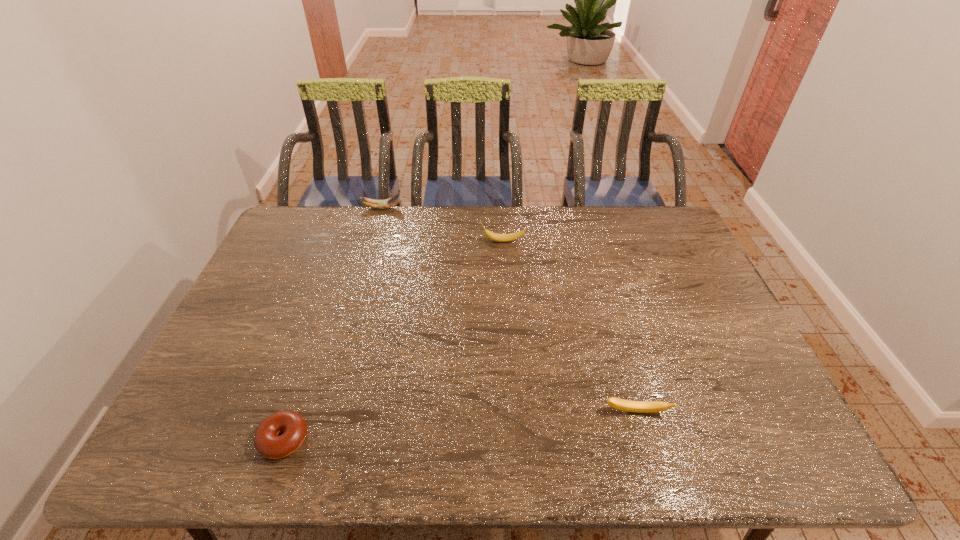
This screenshot has width=960, height=540. In order to click on free spot between the second farthest banana and the nearest banana in this screenshot , I will do `click(569, 327)`.

What are the coordinates of `unoccupied area between the third tallest object and the shortest object` in the screenshot? It's located at (460, 426).

Locate an element on the screen. Image resolution: width=960 pixels, height=540 pixels. empty space that is in between the second farthest object and the third tallest object is located at coordinates (569, 327).

Find the location of a particular element. The width and height of the screenshot is (960, 540). unoccupied position between the doughnut and the second tallest object is located at coordinates (393, 340).

Locate an element on the screen. free space between the doughnut and the leftmost banana is located at coordinates (333, 323).

I want to click on free space between the doughnut and the leftmost banana, so click(x=333, y=323).

Identify the location of free point between the farthest banana and the second nearest banana. This screenshot has width=960, height=540. (442, 225).

Identify the location of vacant area that lies between the second farthest banana and the shortest object. The width and height of the screenshot is (960, 540). [x=393, y=340].

At what (x,y) coordinates should I click in order to perform the action: click on free space between the shortest object and the nearest banana. Please return your answer as a coordinate pair (x, y). The image size is (960, 540). Looking at the image, I should click on (460, 426).

I want to click on unoccupied area between the rightmost object and the leftmost banana, so click(509, 310).